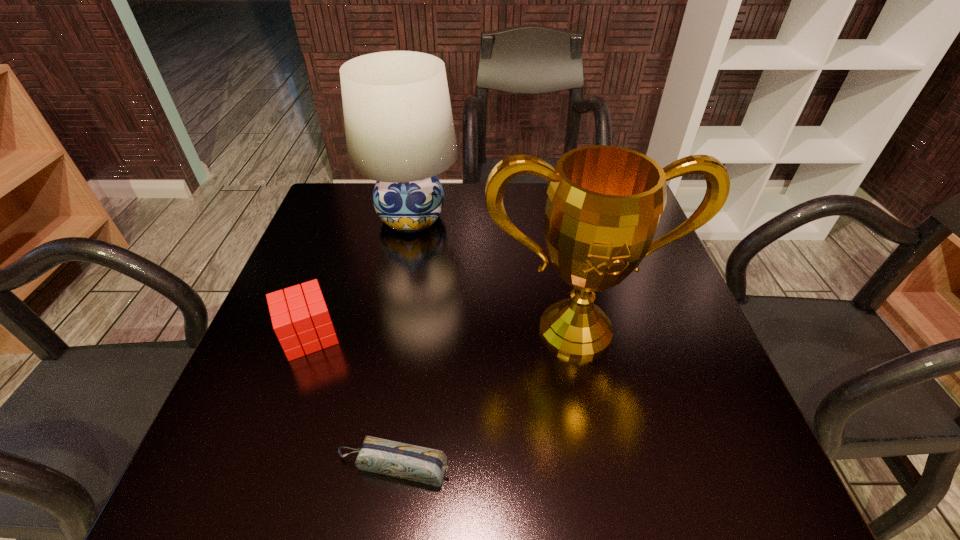
I want to click on object positioned at the near edge, so click(425, 465).

The height and width of the screenshot is (540, 960). I want to click on lampshade situated at the left edge, so click(x=399, y=128).

Locate an element on the screen. cube that is at the left edge is located at coordinates (298, 320).

Locate an element on the screen. The image size is (960, 540). object present at the right edge is located at coordinates (604, 203).

The width and height of the screenshot is (960, 540). I want to click on object at the far left corner, so 399,128.

At what (x,y) coordinates should I click in order to perform the action: click on vacant region at the far edge of the desktop. Please return your answer as a coordinate pair (x, y). This screenshot has height=540, width=960. Looking at the image, I should click on coord(460,187).

Identify the location of free point at the near edge. The height and width of the screenshot is (540, 960). (588, 482).

The image size is (960, 540). I want to click on vacant space at the left edge, so click(248, 392).

Where is `free region at the right edge`? Image resolution: width=960 pixels, height=540 pixels. free region at the right edge is located at coordinates (709, 376).

Find the location of a particular element. vacant space at the far left corner of the desktop is located at coordinates (338, 228).